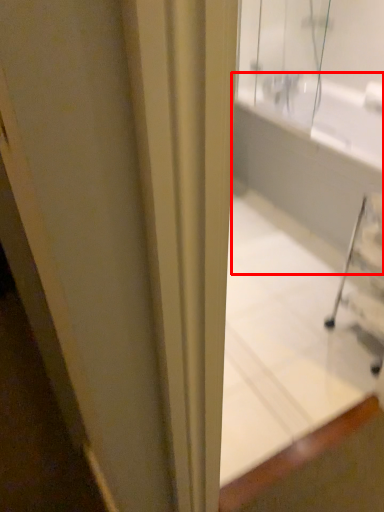
Question: Where is bath (annotated by the red box) located in relation to bathtub in the image?

Choices:
 (A) left
 (B) right

Answer: (B)